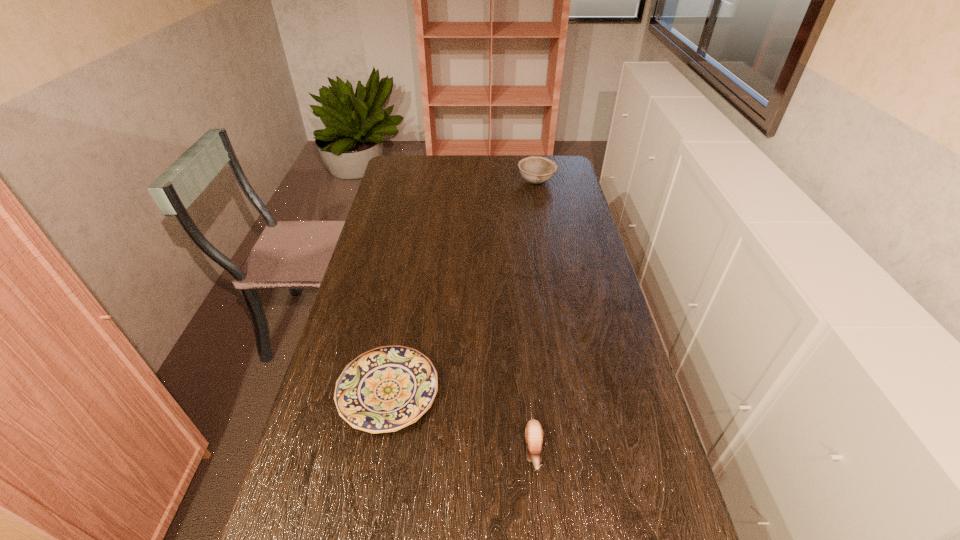
Image resolution: width=960 pixels, height=540 pixels. Identify the location of object that is at the left edge. (385, 389).

Find the location of a particular element. object located in the right edge section of the desktop is located at coordinates (537, 170).

Where is `object at the far right corner`? This screenshot has height=540, width=960. object at the far right corner is located at coordinates (537, 170).

I want to click on vacant space at the far edge of the desktop, so click(x=431, y=170).

The image size is (960, 540). I want to click on vacant space at the left edge, so click(x=367, y=288).

Identify the location of free region at the right edge of the desktop. The width and height of the screenshot is (960, 540). [x=565, y=185].

Where is `blank space at the far left corner`? blank space at the far left corner is located at coordinates (414, 167).

Locate an element on the screen. This screenshot has height=540, width=960. free spot between the second object from right to left and the farthest object is located at coordinates (535, 316).

Locate an element on the screen. This screenshot has height=540, width=960. vacant space that is in between the bowl and the second tallest object is located at coordinates (535, 316).

At what (x,y) coordinates should I click in order to perform the action: click on vacant area that lies between the tallest object and the second tallest object. Please return your answer as a coordinate pair (x, y). Looking at the image, I should click on (535, 316).